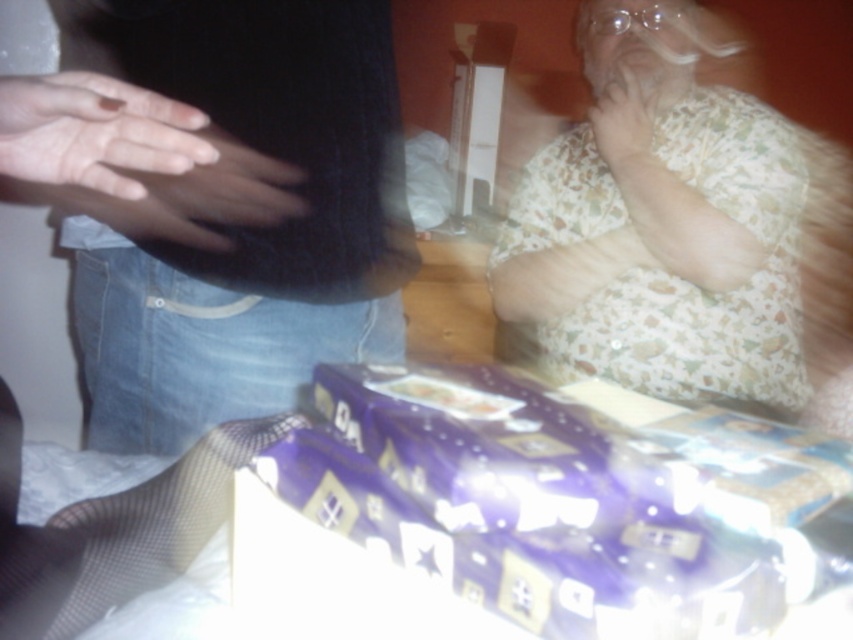
Is matte skin hand at left below matte skin hand at upper right?

Yes.

Between matte skin hand at left and matte skin hand at upper right, which one has less height?

Standing shorter between the two is matte skin hand at left.

This screenshot has height=640, width=853. In order to click on matte skin hand at left in this screenshot , I will do `click(94, 132)`.

The image size is (853, 640). I want to click on matte skin hand at left, so (94, 132).

Is floral cotton shirt at upper right positioned at the back of matte skin hand at left?

Yes, it is behind matte skin hand at left.

Is floral cotton shirt at upper right bigger than matte skin hand at left?

Indeed, floral cotton shirt at upper right has a larger size compared to matte skin hand at left.

Who is more distant from viewer, (125, 435) or (19, 102)?

Positioned behind is point (125, 435).

Identify the location of floral cotton shirt at upper right. (238, 212).

Who is more distant from viewer, (47, 195) or (650, 131)?

Positioned behind is point (47, 195).

Who is more forward, (180, 336) or (646, 148)?

Point (180, 336) is in front.

The width and height of the screenshot is (853, 640). Describe the element at coordinates (238, 212) in the screenshot. I see `floral cotton shirt at upper right` at that location.

Locate an element on the screen. The height and width of the screenshot is (640, 853). floral cotton shirt at upper right is located at coordinates (238, 212).